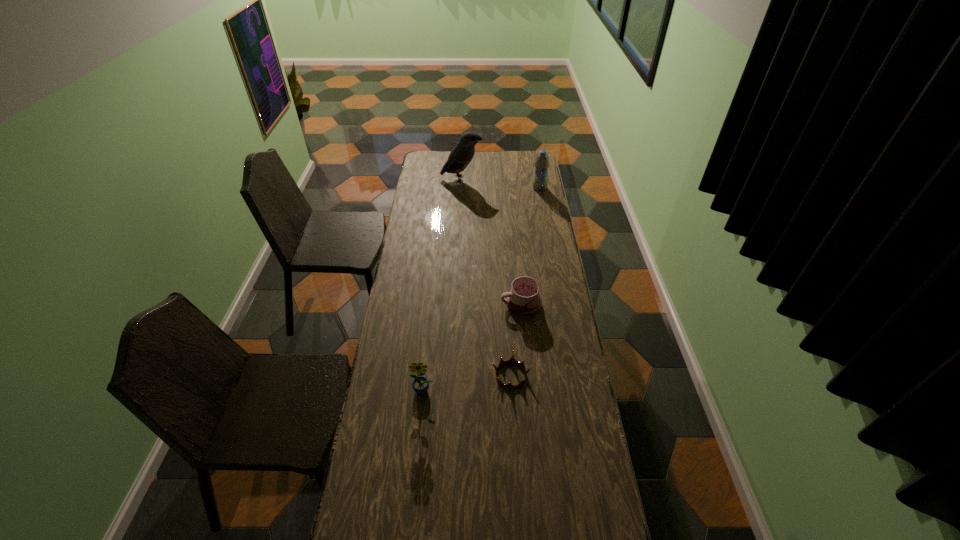
At what (x,y) coordinates should I click in order to perform the action: click on free location at the right edge. Please return your answer as a coordinate pair (x, y). Looking at the image, I should click on (549, 346).

Locate an element on the screen. blank space at the far left corner of the desktop is located at coordinates (439, 160).

Find the location of a particular element. The width and height of the screenshot is (960, 540). free space between the fourth tallest object and the water bottle is located at coordinates (530, 246).

The image size is (960, 540). I want to click on free space between the mug and the parrot, so click(492, 241).

Locate an element on the screen. Image resolution: width=960 pixels, height=540 pixels. vacant space that's between the crown and the third shortest object is located at coordinates (468, 382).

You are a GUI agent. You are given a task and a screenshot of the screen. Output one action in this format:
    pyautogui.click(x=<x>, y=<y>)
    Task: Click on the blank region between the crown and the mug
    The height and width of the screenshot is (540, 960).
    Given the screenshot: What is the action you would take?
    pyautogui.click(x=516, y=340)

At what (x,y) coordinates should I click in order to perform the action: click on vacant point located between the sunflower and the crown. Please return your answer as a coordinate pair (x, y). The image size is (960, 540). Looking at the image, I should click on (468, 382).

The height and width of the screenshot is (540, 960). I want to click on free space that is in between the fourth shortest object and the parrot, so click(500, 183).

At what (x,y) coordinates should I click in order to perform the action: click on free space between the farthest object and the shortest object. Please return your answer as a coordinate pair (x, y). Looking at the image, I should click on (486, 277).

Where is `vacant area between the crown and the mug`? The image size is (960, 540). vacant area between the crown and the mug is located at coordinates (516, 340).